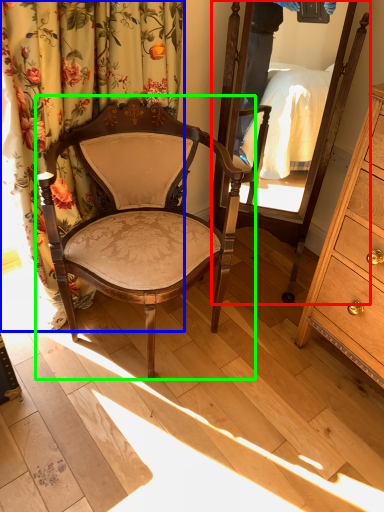
Question: Which object is the closest to the mirror (highlighted by a red box)? Choose among these: curtain (highlighted by a blue box) or chair (highlighted by a green box).

Choices:
 (A) curtain
 (B) chair

Answer: (B)